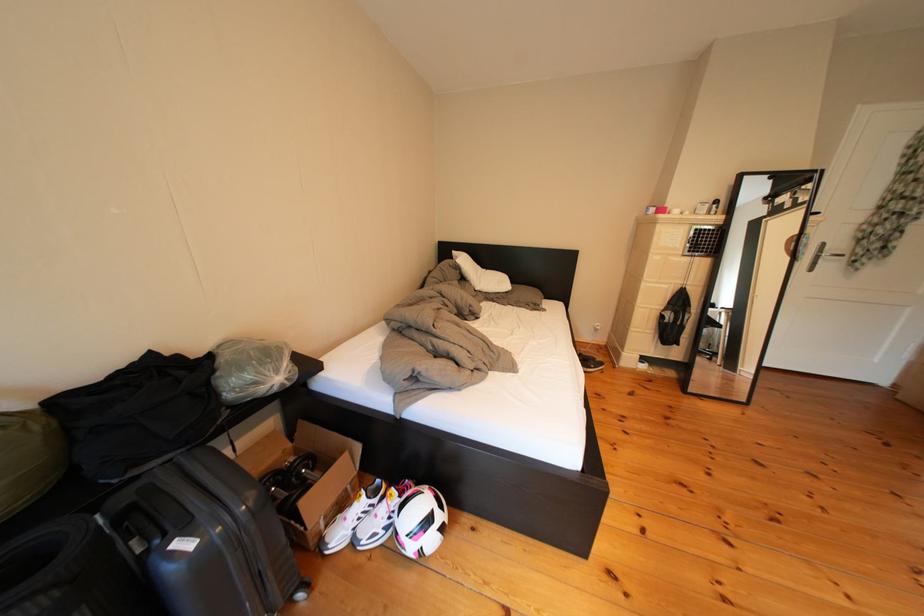
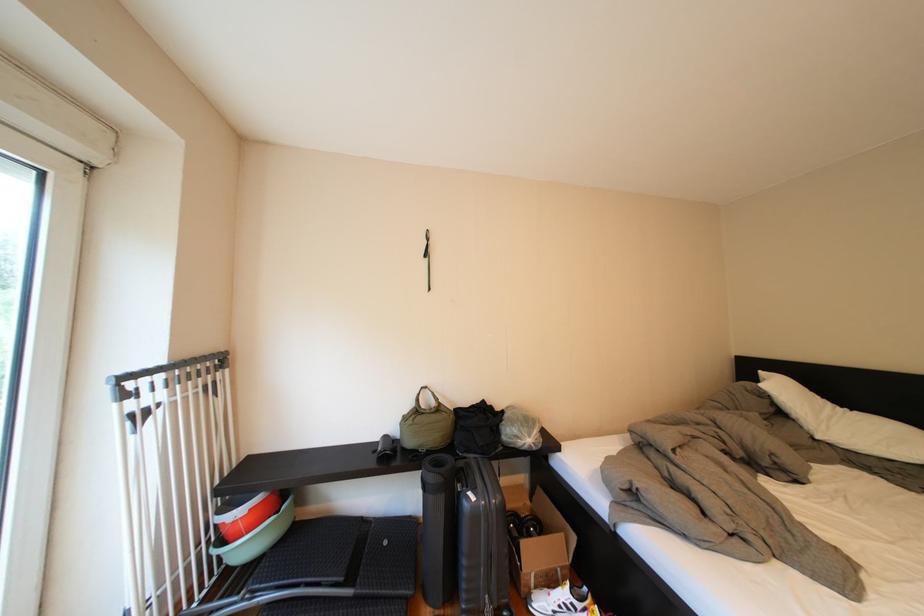
Find the pixel in the second image that matches point 351,541 in the first image.

(554, 609)